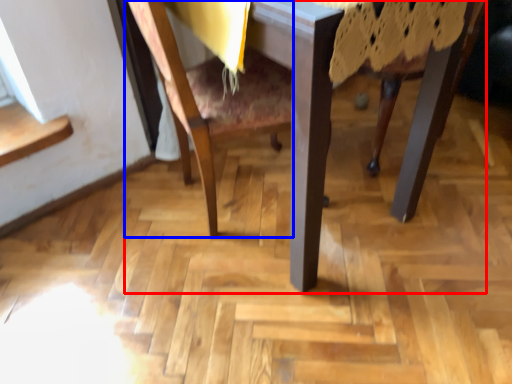
Question: Among these objects, which one is farthest to the camera, table (highlighted by a red box) or chair (highlighted by a blue box)?

Choices:
 (A) table
 (B) chair

Answer: (B)